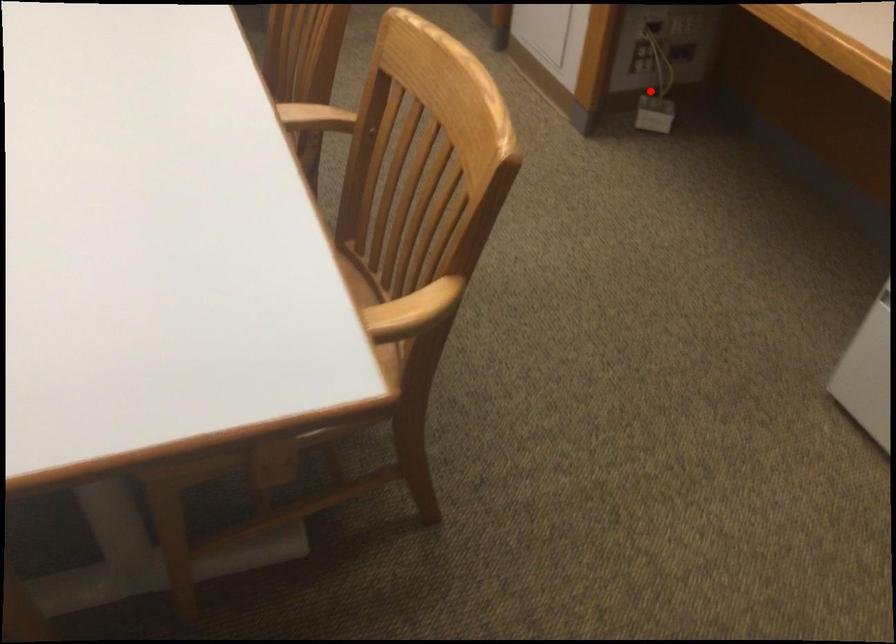
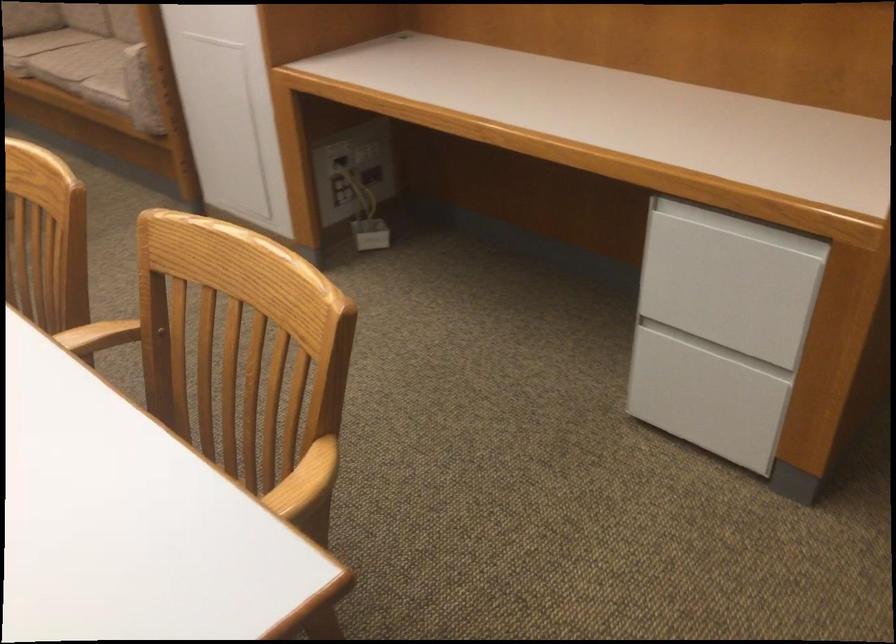
Locate, in the second image, the point that corresponds to the highlighted location in the first image.

(364, 214)